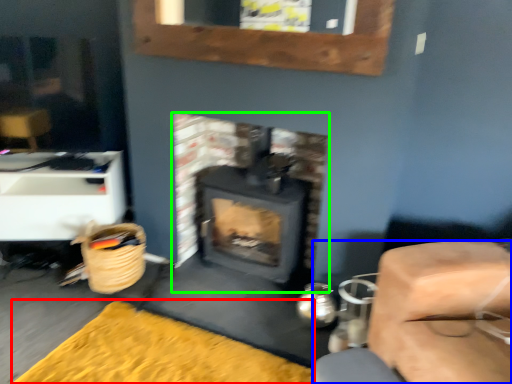
Question: Which object is positioned farthest from doormat (highlighted by a red box)? Select from furniture (highlighted by a blue box) and wood burning stove (highlighted by a green box).

Choices:
 (A) furniture
 (B) wood burning stove

Answer: (B)